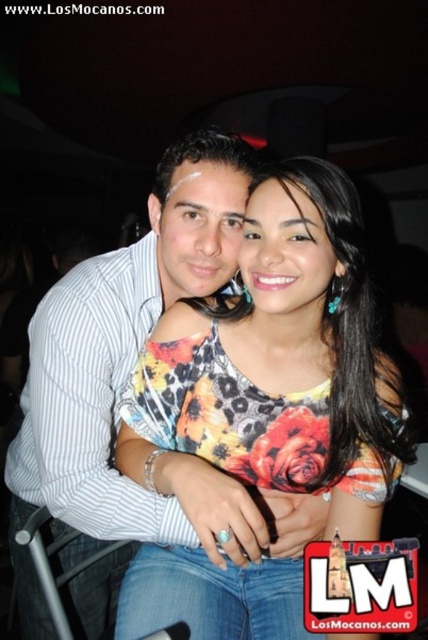
Consider the image. You are organizing a photo shoot and need to ensure that the floral printed top at center and the white striped shirt at center are both visible in the frame. Based on their sizes, which one might require more careful positioning to avoid being cropped out?

The floral printed top at center occupies less space than the white striped shirt at center, so it might require more careful positioning to avoid being cropped out since it is smaller and could be easily missed if not framed properly.

Please look at the image and identify the object located at the coordinates point (x=279, y=365). The scene includes a man in a striped shirt and a woman in a colorful top with a red rose design.

The point (x=279, y=365) corresponds to the floral printed top at center, which is the woman wearing a colorful patterned top with a large red rose design.

You are at a party and want to take a photo of the floral printed top at center and the white striped shirt at center. Which one should you focus on first if you want to capture both clearly in the same frame?

The floral printed top at center is in front of the white striped shirt at center, so you should focus on the floral printed top at center first to ensure both are in focus.